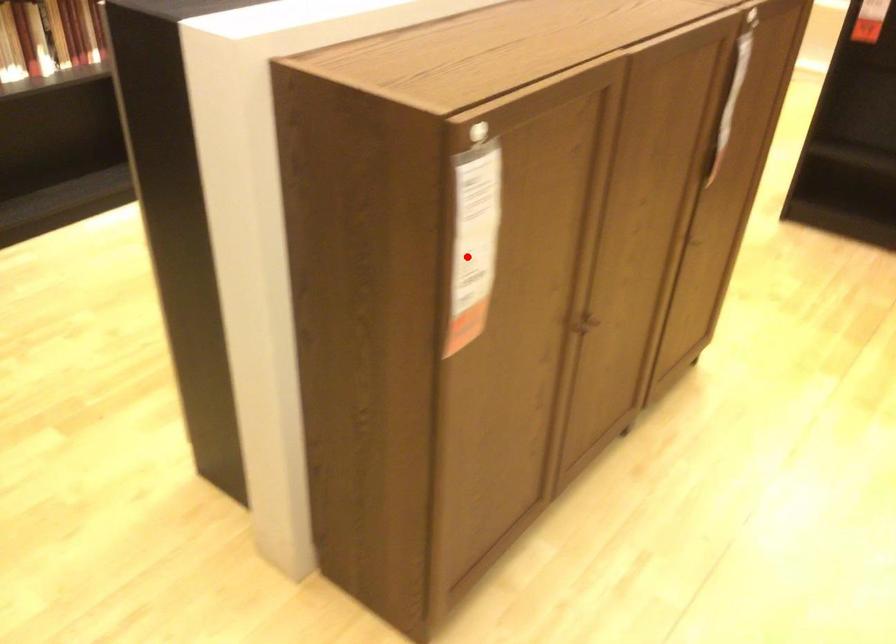
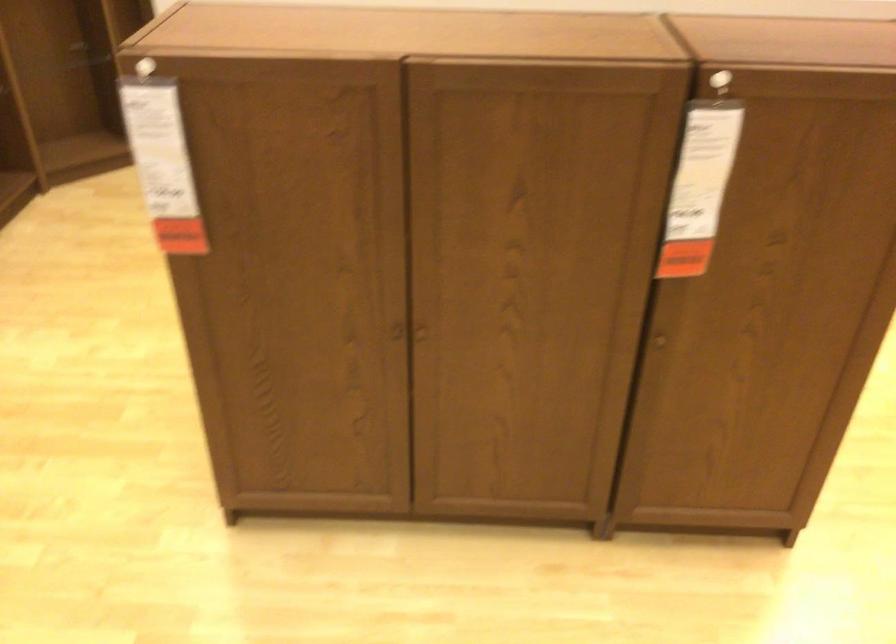
Question: I am providing you with two images of the same scene from different viewpoints. In image1, a red point is highlighted. Considering the same 3D point in image2, which of the following is correct?

Choices:
 (A) It is closer
 (B) It is farther

Answer: (B)